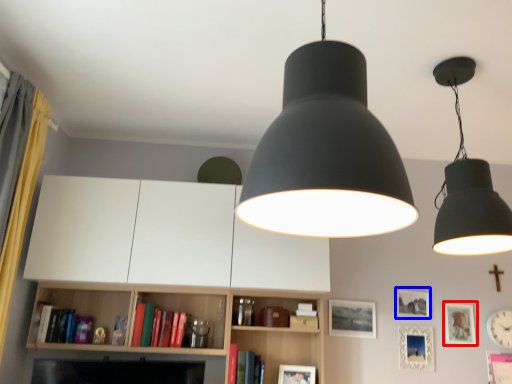
Question: Which object is closer to the camera taking this photo, picture frame (highlighted by a red box) or picture frame (highlighted by a blue box)?

Choices:
 (A) picture frame
 (B) picture frame

Answer: (A)